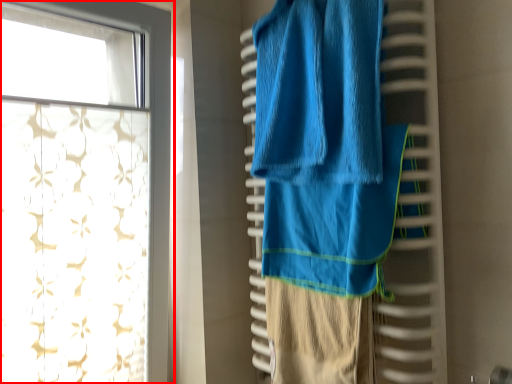
Question: From the image's perspective, what is the correct spatial positioning of curtain (annotated by the red box) in reference to towel?

Choices:
 (A) above
 (B) below

Answer: (B)